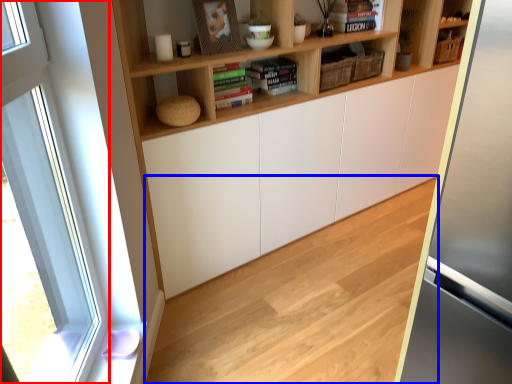
Question: Which of the following is the closest to the observer, window (highlighted by a red box) or hardwood (highlighted by a blue box)?

Choices:
 (A) window
 (B) hardwood

Answer: (A)